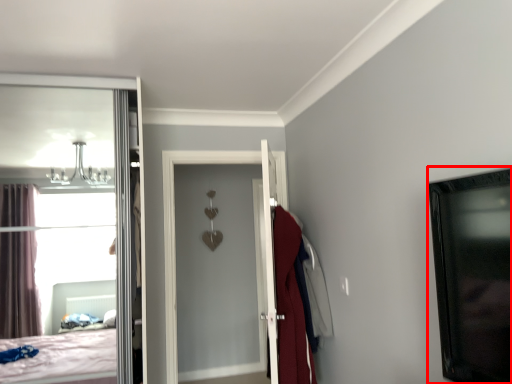
Question: From the image's perspective, what is the correct spatial relationship of picture frame (annotated by the red box) in relation to robe?

Choices:
 (A) above
 (B) below

Answer: (A)